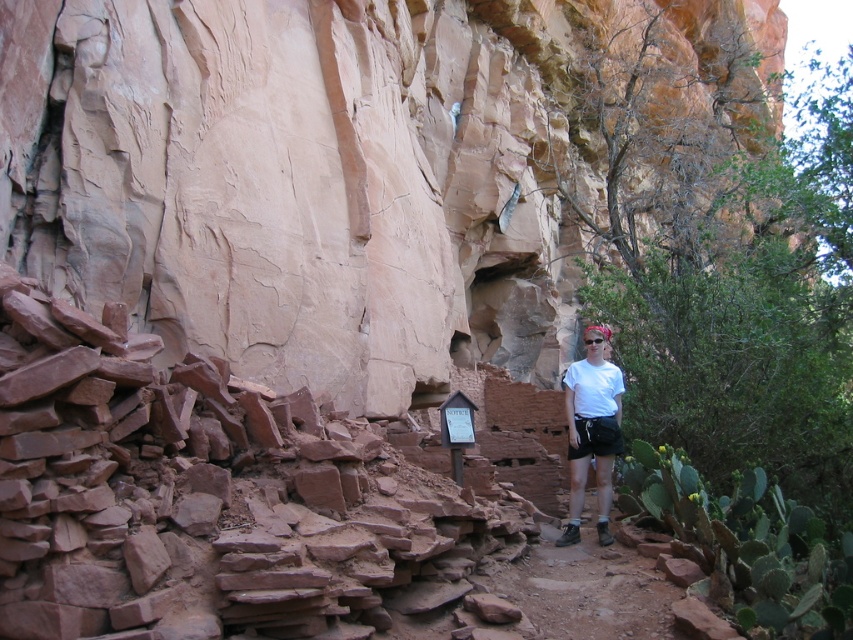
Is rustic stone rubble at center-left positioned before white cotton shirt at center?

Yes, it is.

Consider the image. Which is below, rustic stone rubble at center-left or white cotton shirt at center?

rustic stone rubble at center-left is lower down.

Who is more forward, (62,508) or (599,324)?

Point (62,508)

What are the coordinates of `rustic stone rubble at center-left` in the screenshot? It's located at (202, 493).